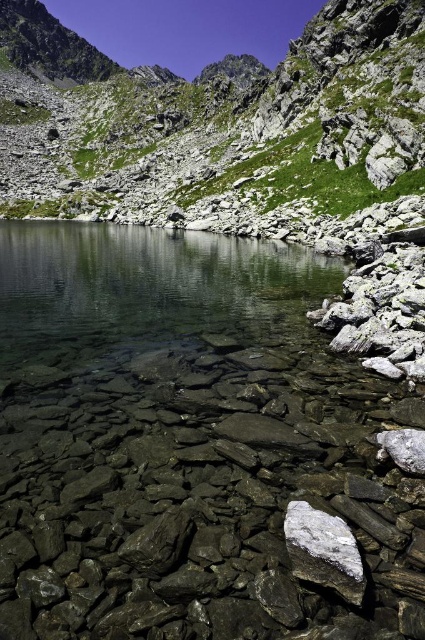
Does clear stone water at center appear on the left side of white crystalline rock at center?

Yes, clear stone water at center is to the left of white crystalline rock at center.

Between clear stone water at center and white crystalline rock at center, which one has less height?

Standing shorter between the two is white crystalline rock at center.

Is point (183, 456) closer to camera compared to point (300, 561)?

No, it is not.

Locate an element on the screen. clear stone water at center is located at coordinates (195, 448).

Who is shorter, clear glass water at center or white crystalline rock at center?

white crystalline rock at center is shorter.

Which is behind, point (50, 323) or point (328, 515)?

The point (50, 323) is behind.

Is point (172, 307) behind point (297, 515)?

Yes, it is behind point (297, 515).

This screenshot has width=425, height=640. I want to click on clear glass water at center, so click(147, 291).

Can you confirm if clear stone water at center is smaller than clear glass water at center?

Indeed, clear stone water at center has a smaller size compared to clear glass water at center.

Between clear stone water at center and clear glass water at center, which one has less height?

clear stone water at center

Is point (319, 268) closer to camera compared to point (147, 328)?

That is False.

Identify the location of clear stone water at center. (195, 448).